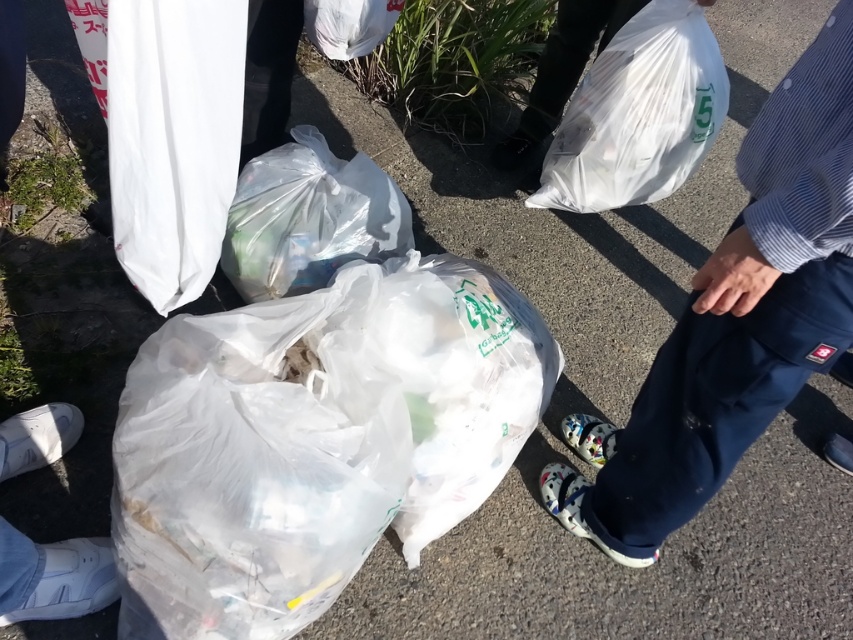
You are a photographer taking a picture of the cleanup scene. You notice the transparent plastic bag at center and the white matte sneakers at lower left. Which object is closer to the camera?

The transparent plastic bag at center is closer to the camera since it is in front of the white matte sneakers at lower left.

You are a photographer trying to capture the translucent plastic bag at center and the white matte sneakers at lower left in a single shot. Which object should you focus on first to ensure both are in frame without moving the camera?

The translucent plastic bag at center is much taller than the white matte sneakers at lower left, so you should focus on the translucent plastic bag at center first to ensure both are in frame without moving the camera.

You are a photographer trying to capture the translucent plastic bag at center and the white matte sneakers at lower left in a single frame. Based on their sizes, which object would appear bigger in the photo?

The translucent plastic bag at center would appear bigger in the photo since it is larger in size than the white matte sneakers at lower left.